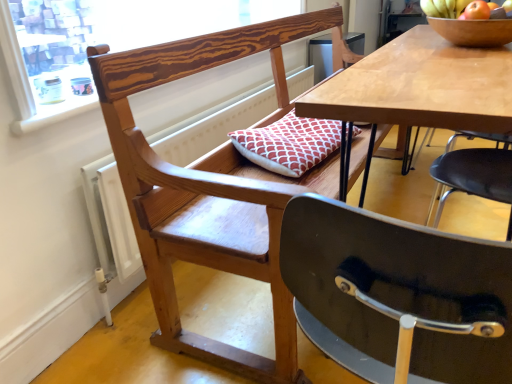
Question: Is wooden bowl at upper right a part of wooden frame at upper left?

Choices:
 (A) no
 (B) yes

Answer: (A)

Question: Is wooden frame at upper left facing away from wooden bowl at upper right?

Choices:
 (A) yes
 (B) no

Answer: (B)

Question: Is wooden frame at upper left wider than wooden bowl at upper right?

Choices:
 (A) yes
 (B) no

Answer: (B)

Question: Is wooden frame at upper left not inside wooden bowl at upper right?

Choices:
 (A) no
 (B) yes

Answer: (B)

Question: Is the depth of wooden frame at upper left greater than that of wooden bowl at upper right?

Choices:
 (A) no
 (B) yes

Answer: (A)

Question: In the image, is wooden radiator at left positioned in front of or behind wooden chair with cushion at center?

Choices:
 (A) behind
 (B) front

Answer: (A)

Question: In terms of height, does wooden radiator at left look taller or shorter compared to wooden chair with cushion at center?

Choices:
 (A) tall
 (B) short

Answer: (B)

Question: Do you think wooden radiator at left is within wooden chair with cushion at center, or outside of it?

Choices:
 (A) outside
 (B) inside

Answer: (A)

Question: Is wooden radiator at left to the left or to the right of wooden chair with cushion at center in the image?

Choices:
 (A) right
 (B) left

Answer: (B)

Question: Is wooden bowl at upper right in front of or behind shiny golden bananas at upper right in the image?

Choices:
 (A) behind
 (B) front

Answer: (B)

Question: In terms of width, does wooden bowl at upper right look wider or thinner when compared to shiny golden bananas at upper right?

Choices:
 (A) wide
 (B) thin

Answer: (A)

Question: From the image's perspective, is wooden bowl at upper right above or below shiny golden bananas at upper right?

Choices:
 (A) above
 (B) below

Answer: (B)

Question: From a real-world perspective, relative to shiny golden bananas at upper right, is wooden bowl at upper right vertically above or below?

Choices:
 (A) above
 (B) below

Answer: (B)

Question: From a real-world perspective, is wooden radiator at left positioned above or below shiny golden bananas at upper right?

Choices:
 (A) below
 (B) above

Answer: (A)

Question: From the image's perspective, is wooden radiator at left above or below shiny golden bananas at upper right?

Choices:
 (A) above
 (B) below

Answer: (B)